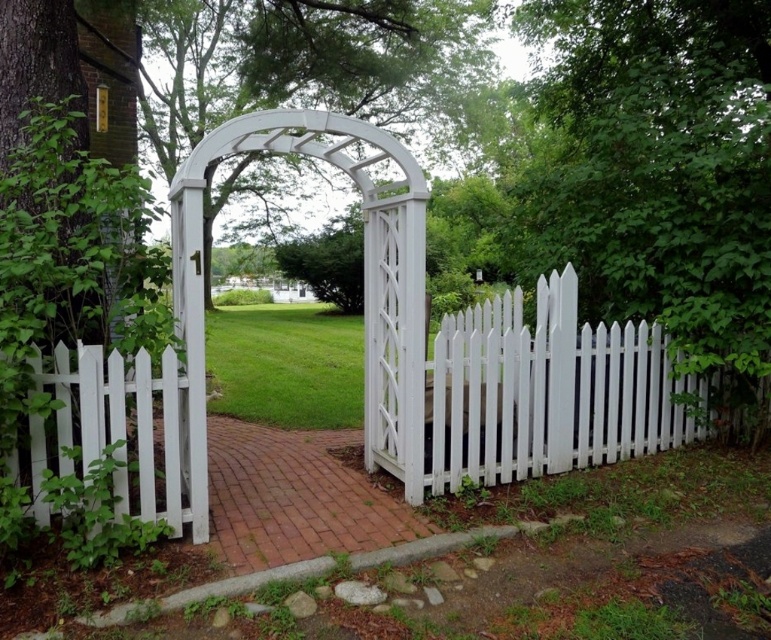
Can you confirm if white picket fence at center is thinner than white picket fence at left?

Incorrect, white picket fence at center's width is not less than white picket fence at left's.

Is white picket fence at center positioned in front of white picket fence at left?

No, it is behind white picket fence at left.

This screenshot has height=640, width=771. What do you see at coordinates (540, 394) in the screenshot?
I see `white picket fence at center` at bounding box center [540, 394].

The height and width of the screenshot is (640, 771). Identify the location of white picket fence at center. (540, 394).